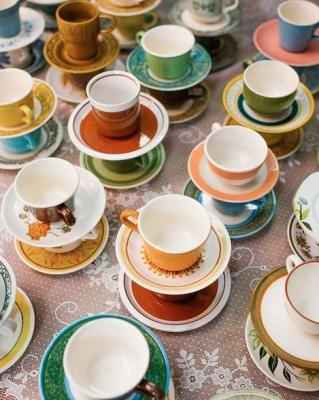
Identify the location of swirls on tablecloth. The image size is (319, 400). (309, 146), (309, 134), (188, 137), (251, 253), (251, 282), (60, 317), (68, 147), (255, 11), (251, 43), (29, 356).